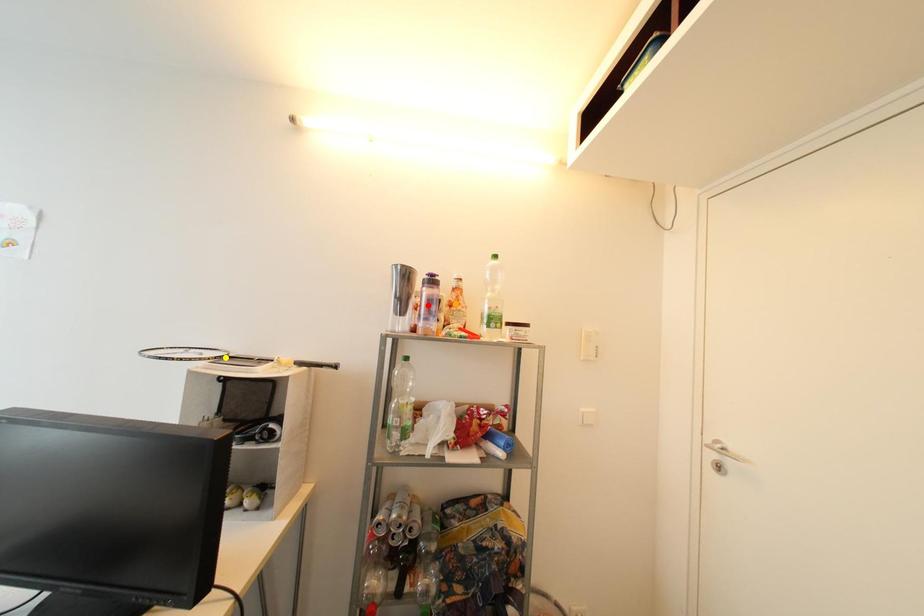
Order these from nearest to farthest:
red point, yellow point, orange point

red point → yellow point → orange point